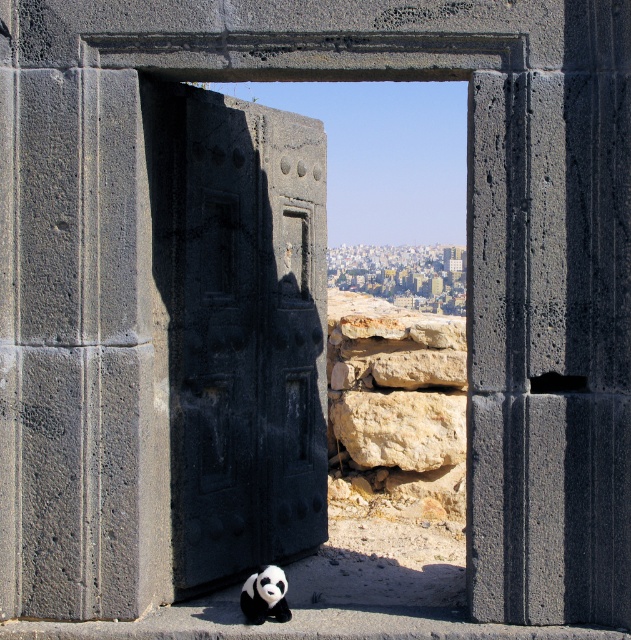
You are standing in front of an ancient structure and notice a dark gray stone door at center. Can you determine if the dark gray stone door at center is located to the left or right of the point marked at coordinates (242,332)?

The dark gray stone door at center is exactly at the point marked at coordinates (242,332), so it is neither to the left nor right of that point.

You are a delivery person trying to place a small package on the ground near the dark gray stone door at center. However, there is a black plush panda at lower center in the way. Can you move the panda to the side to make space for the package?

The dark gray stone door at center is taller than the black plush panda at lower center, so you can move the black plush panda at lower center out of the way to create space for the package.

You are an architect assessing the doorway structure. Given the dark gray stone door at center and the black plush panda at lower center, which object would require more space to accommodate in a scaled model? Explain your reasoning based on their sizes.

The dark gray stone door at center requires more space in a scaled model because it is larger than the black plush panda at lower center.